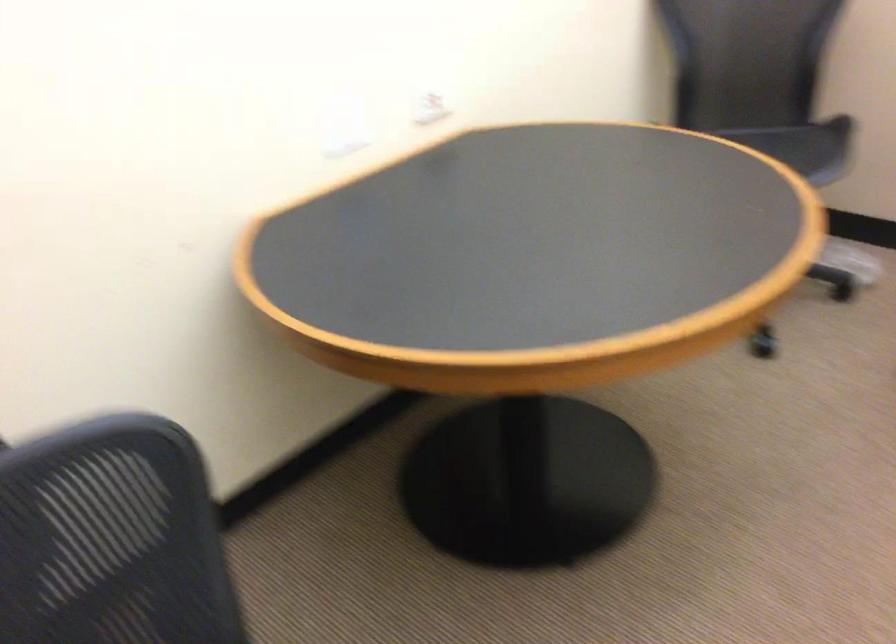
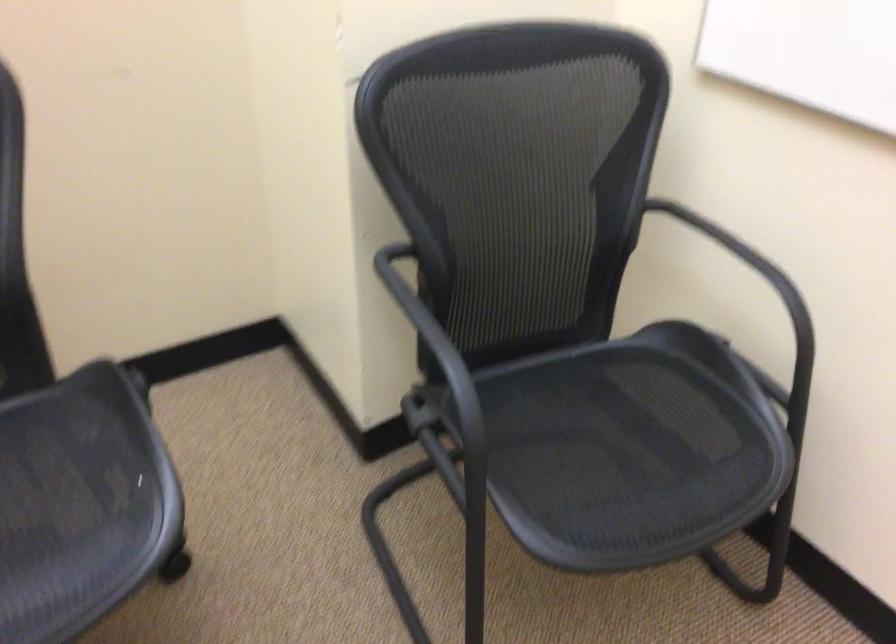
The first image is from the beginning of the video and the second image is from the end. How did the camera likely rotate when shooting the video?

The camera rotated toward right-down.